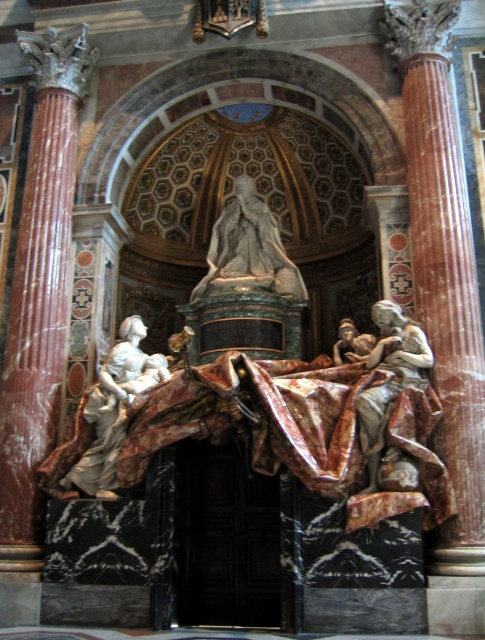
You are an architect designing a new cathedral and want to incorporate a similar sculptural group. The point representing the marble statue of woman holding child at left is at coordinates point (113, 406). What does this coordinate indicate about the statue?

The coordinate point (113, 406) indicates the position of the marble statue of woman holding child at left within the image, with 0.637 representing the horizontal axis and 0.235 the vertical axis.

You are an architect analyzing the structural integrity of the space. The marble column at left is located at coordinate point 0.450, 0.082. If you need to place a support beam directly above it, where should the beam be positioned?

The support beam should be positioned directly above the marble column at left at coordinate point (39, 288) to ensure structural stability.

You are an architect designing a new cathedral and need to place a new sculpture between the marble column at left and the marble statue of woman holding child at left. Which object should you move to make space?

The marble column at left might be wider than the marble statue of woman holding child at left, so you should consider moving the marble column at left to create more space.